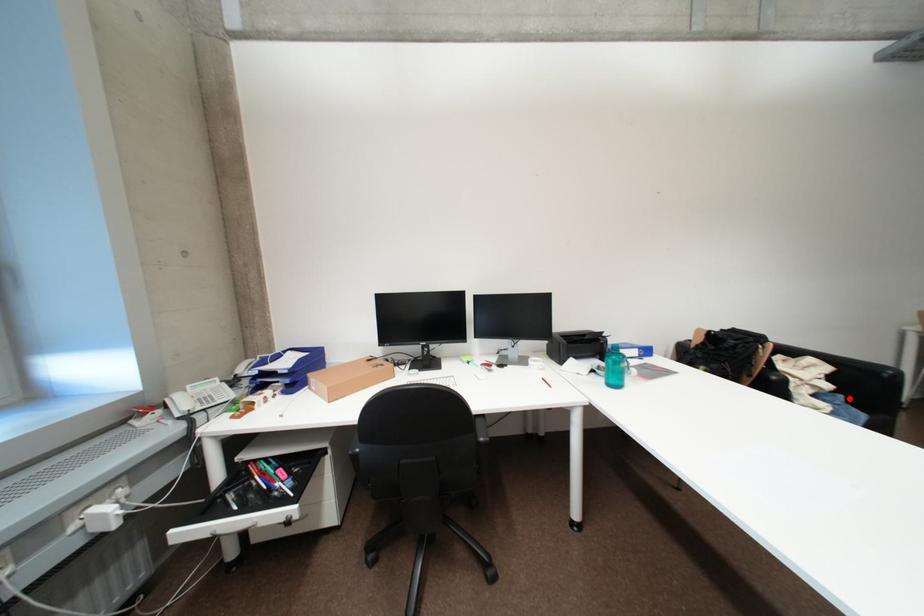
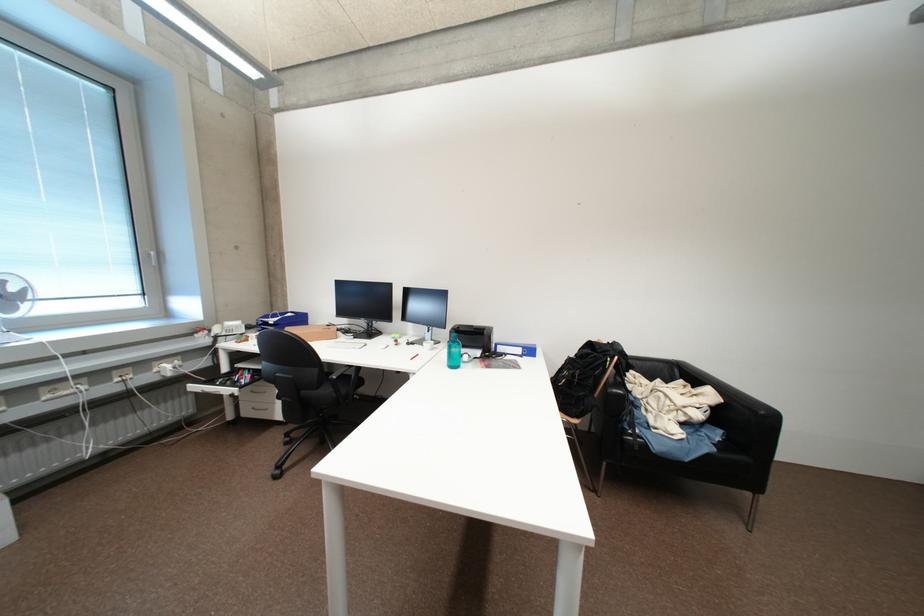
Question: I am providing you with two images of the same scene from different viewpoints. Image1 has a red point marked. In image2, the corresponding 3D location appears at what relative position? Reply with the corresponding letter.

Choices:
 (A) Closer
 (B) Farther

Answer: (B)